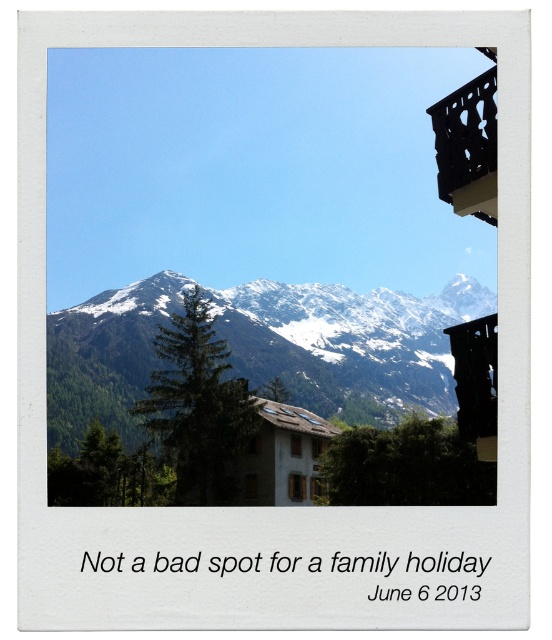
Who is positioned more to the left, snowy rock mountain range at center or black wrought iron balcony at upper right?

snowy rock mountain range at center is more to the left.

Is snowy rock mountain range at center bigger than black wrought iron balcony at upper right?

Correct, snowy rock mountain range at center is larger in size than black wrought iron balcony at upper right.

I want to click on snowy rock mountain range at center, so (x=348, y=342).

Identify the location of snowy rock mountain range at center. (348, 342).

Is black wrought iron balcony at upper right bigger than black wood balcony at upper right?

Yes.

Describe the element at coordinates (468, 147) in the screenshot. I see `black wrought iron balcony at upper right` at that location.

The image size is (552, 640). Find the location of `black wrought iron balcony at upper right`. black wrought iron balcony at upper right is located at coordinates (468, 147).

Between point (351, 317) and point (464, 365), which one is positioned in front?

Positioned in front is point (464, 365).

Which of these two, snowy rock mountain range at center or black wood balcony at upper right, stands shorter?

black wood balcony at upper right

This screenshot has width=552, height=640. In order to click on snowy rock mountain range at center in this screenshot , I will do `click(348, 342)`.